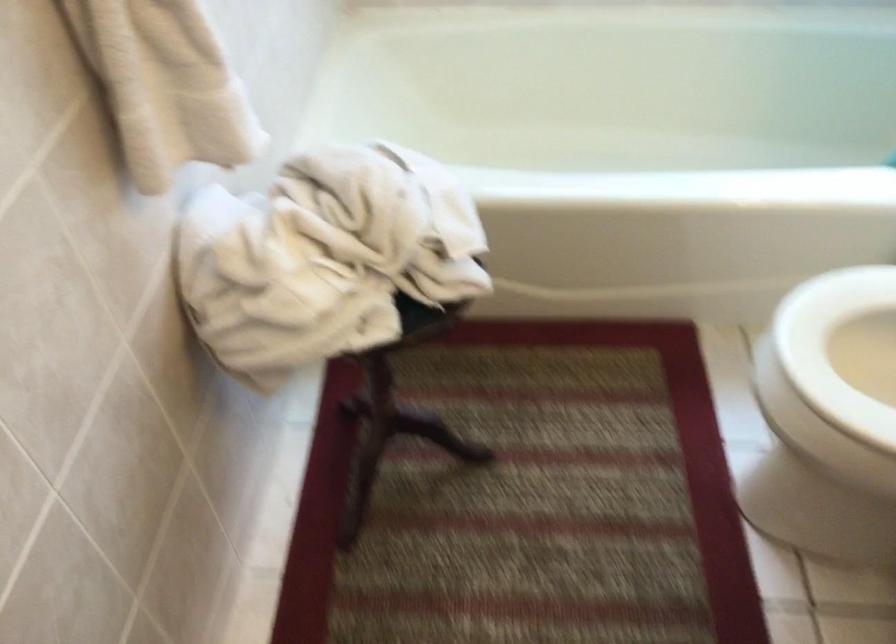
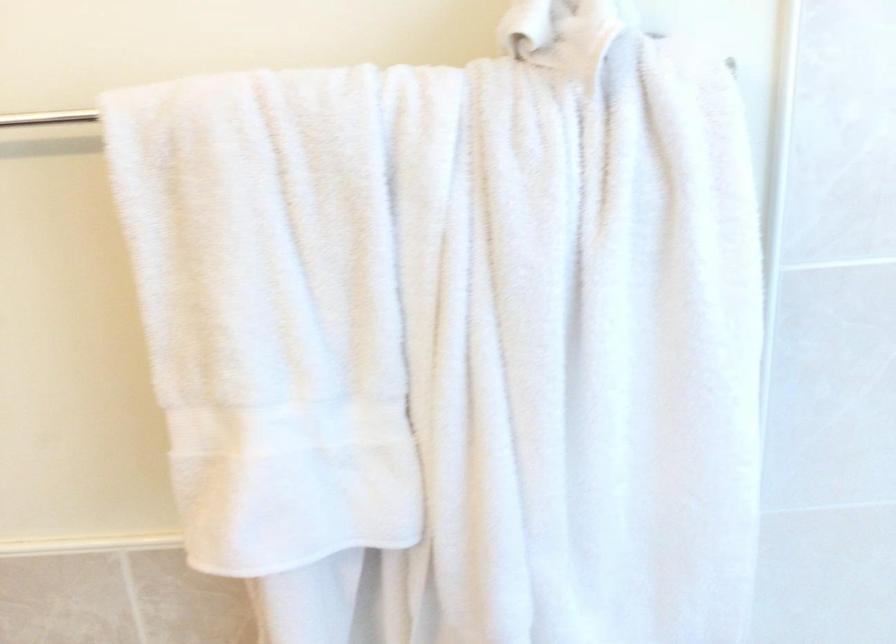
Question: Based on the continuous images, in which direction is the camera rotating? Reply with the corresponding letter.

Choices:
 (A) Left
 (B) Right
 (C) Up
 (D) Down

Answer: (A)